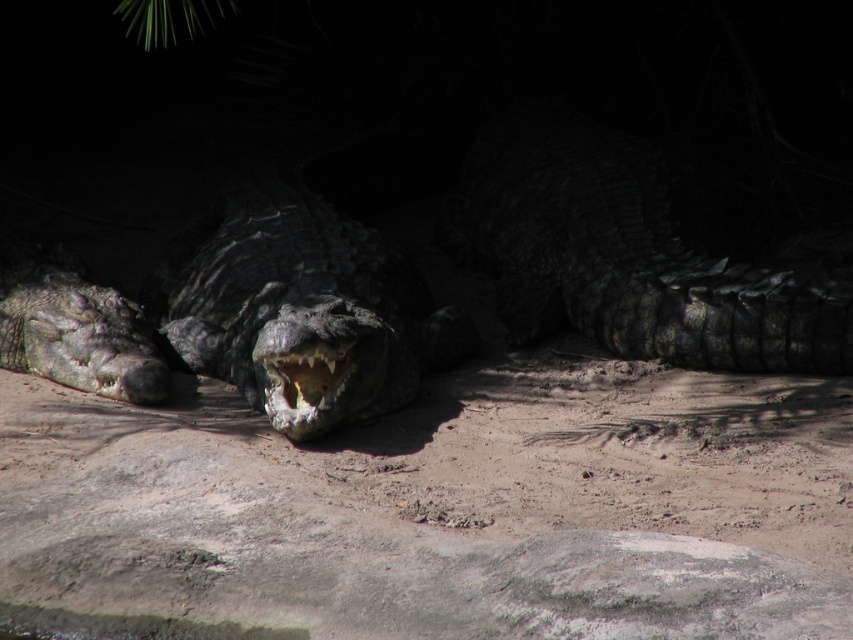
Question: Can you confirm if dark gray scaly crocodile at left is smaller than dark gray textured mouth at center?

Choices:
 (A) no
 (B) yes

Answer: (A)

Question: Does dark gray scaly crocodile at left have a larger size compared to dark gray textured mouth at center?

Choices:
 (A) yes
 (B) no

Answer: (A)

Question: Which of the following is the farthest from the observer?

Choices:
 (A) dark gray textured mouth at center
 (B) shiny black crocodile at center

Answer: (B)

Question: Based on their relative distances, which object is farther from the dark gray textured mouth at center?

Choices:
 (A) shiny black crocodile at center
 (B) dark scaly crocodile at center
 (C) dark gray scaly crocodile at left

Answer: (C)

Question: Where is shiny black crocodile at center located in relation to dark gray textured mouth at center in the image?

Choices:
 (A) below
 (B) above

Answer: (B)

Question: Which object is farther from the camera taking this photo?

Choices:
 (A) dark gray textured mouth at center
 (B) dark gray scaly crocodile at left
 (C) dark scaly crocodile at center

Answer: (B)